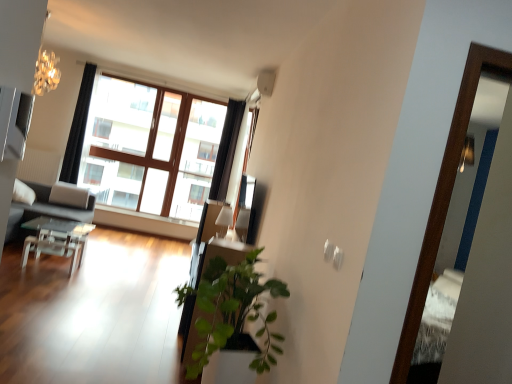
Question: From a real-world perspective, relative to white painted wood at center, is matte gray couch at left vertically above or below?

Choices:
 (A) below
 (B) above

Answer: (B)

Question: Does point (41, 185) appear closer or farther from the camera than point (118, 221)?

Choices:
 (A) farther
 (B) closer

Answer: (B)

Question: Which object is the closest to the black fabric curtain at upper left, which appears as the 1th curtain when viewed from the left?

Choices:
 (A) green leafy plant at center
 (B) matte gray couch at left
 (C) black fabric curtain at upper center, which is counted as the second curtain, starting from the left
 (D) transparent glass table at lower left
 (E) wooden screen door at right

Answer: (B)

Question: Based on their relative distances, which object is nearer to the green leafy plant at center?

Choices:
 (A) black fabric curtain at upper left, the 2th curtain positioned from the right
 (B) white painted wood at center
 (C) matte gray couch at left
 (D) wooden screen door at right
 (E) transparent glass table at lower left

Answer: (D)